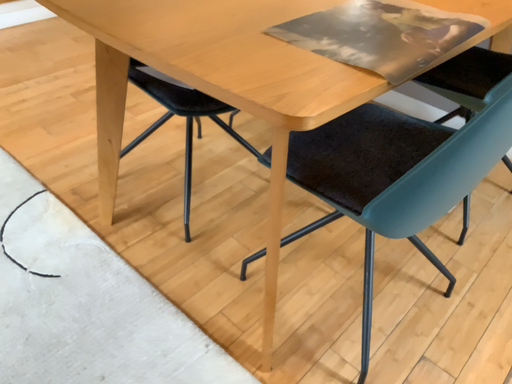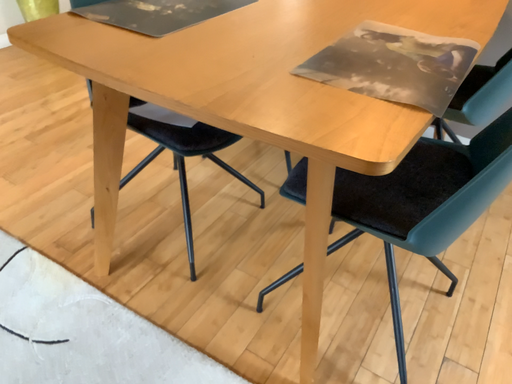
Question: How did the camera likely rotate when shooting the video?

Choices:
 (A) rotated left
 (B) rotated right

Answer: (B)